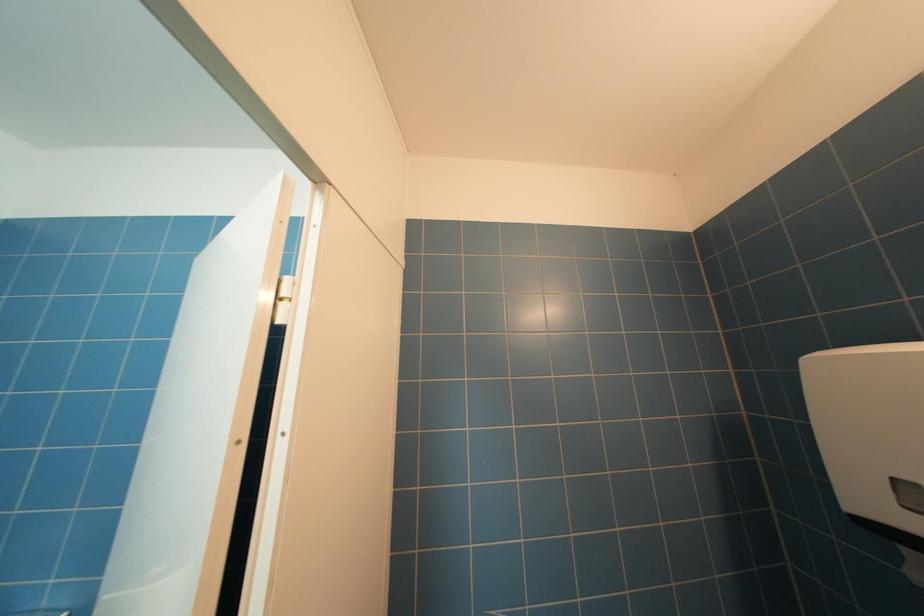
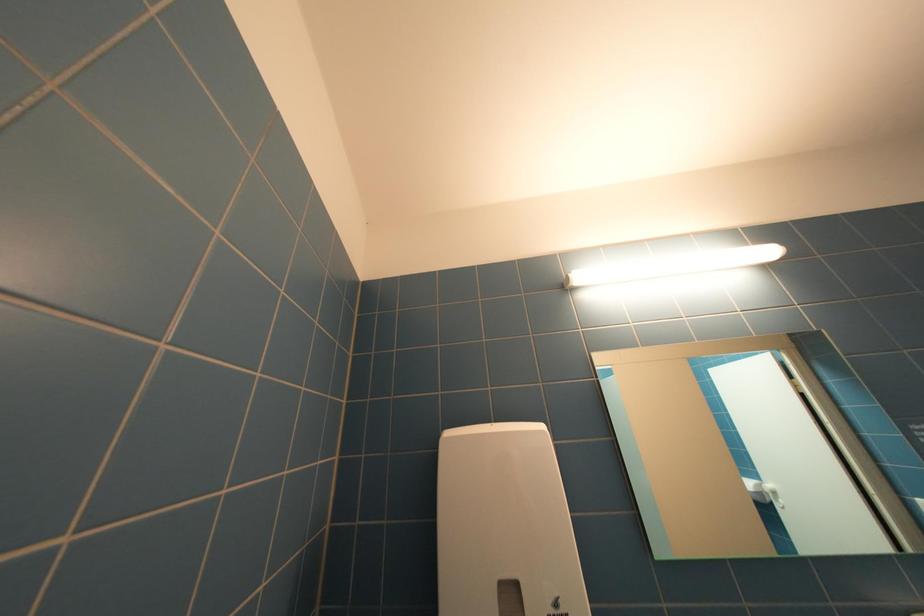
First-person continuous shooting, in which direction is the camera rotating?

The camera's rotation is toward right-up.